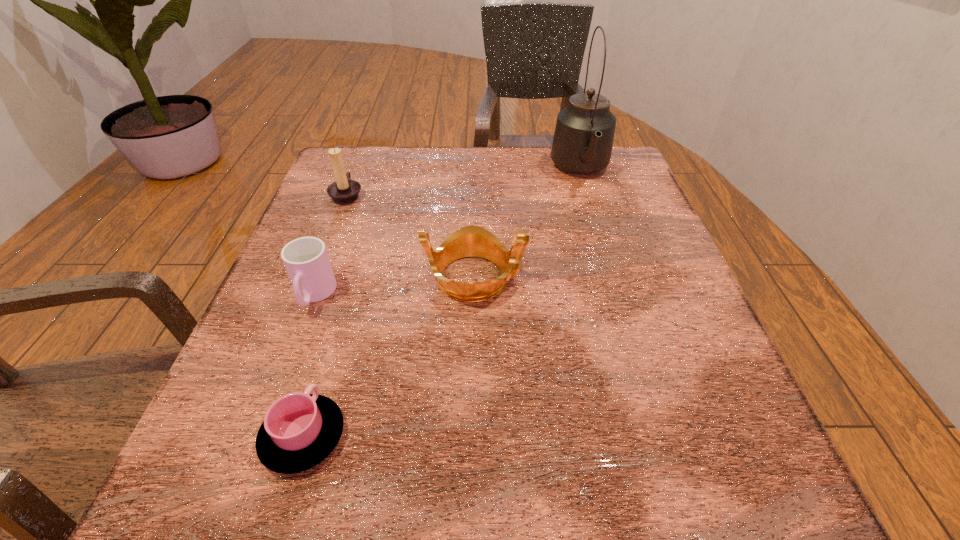
At what (x,y) coordinates should I click in order to perform the action: click on vacant area that lies between the fourth tallest object and the candle holder. Please return your answer as a coordinate pair (x, y). Looking at the image, I should click on (330, 245).

You are a GUI agent. You are given a task and a screenshot of the screen. Output one action in this format:
    pyautogui.click(x=<x>, y=<y>)
    Task: Click on the blank region between the second shortest object and the nearest object
    Image resolution: width=960 pixels, height=540 pixels.
    Given the screenshot: What is the action you would take?
    pyautogui.click(x=308, y=366)

This screenshot has width=960, height=540. Identify the location of free space between the fourth object from left to right and the farther cup. (395, 286).

This screenshot has width=960, height=540. I want to click on vacant point located between the tallest object and the candle holder, so click(x=464, y=183).

The width and height of the screenshot is (960, 540). Find the location of `free area in between the shorter cup and the taller cup`. free area in between the shorter cup and the taller cup is located at coordinates (308, 366).

The image size is (960, 540). I want to click on empty space between the candle holder and the kettle, so click(464, 183).

Where is `free space between the kettle and the fourth tallest object`? The image size is (960, 540). free space between the kettle and the fourth tallest object is located at coordinates (447, 233).

You are a GUI agent. You are given a task and a screenshot of the screen. Output one action in this format:
    pyautogui.click(x=<x>, y=<y>)
    Task: Click on the vacant area that lies between the farther cup and the tiara
    
    Given the screenshot: What is the action you would take?
    pyautogui.click(x=395, y=286)

Where is `free area in between the fourth object from left to right and the candle holder`? The image size is (960, 540). free area in between the fourth object from left to right and the candle holder is located at coordinates (411, 236).

Identify which object is the second nearest to the shorter cup. Please provide its 2D coordinates. Your answer should be formatted as a tuple, i.e. [(x, y)], where the tuple contains the x and y coordinates of a point satisfying the conditions above.

[(470, 241)]